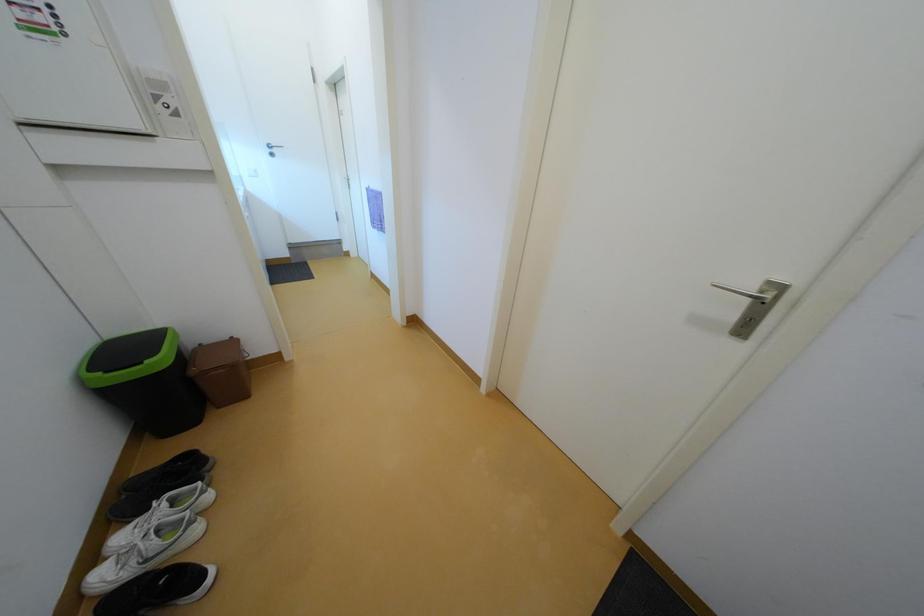
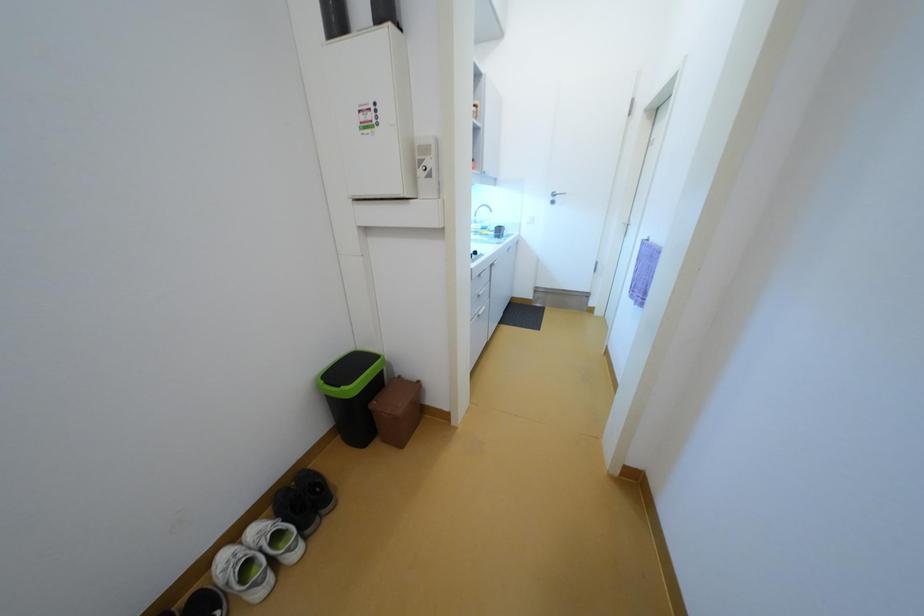
Question: The first image is from the beginning of the video and the second image is from the end. How did the camera likely rotate when shooting the video?

Choices:
 (A) Left
 (B) Right
 (C) Up
 (D) Down

Answer: (A)